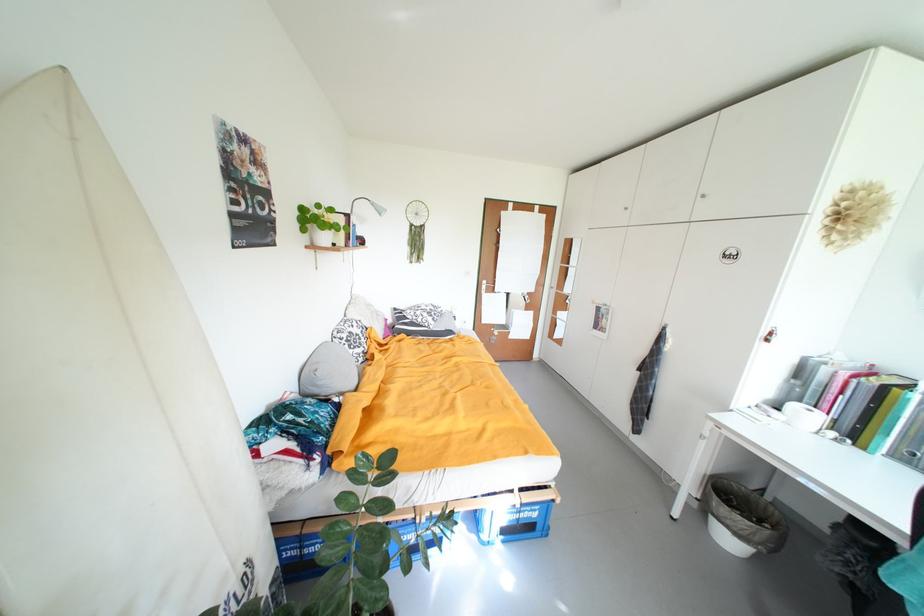
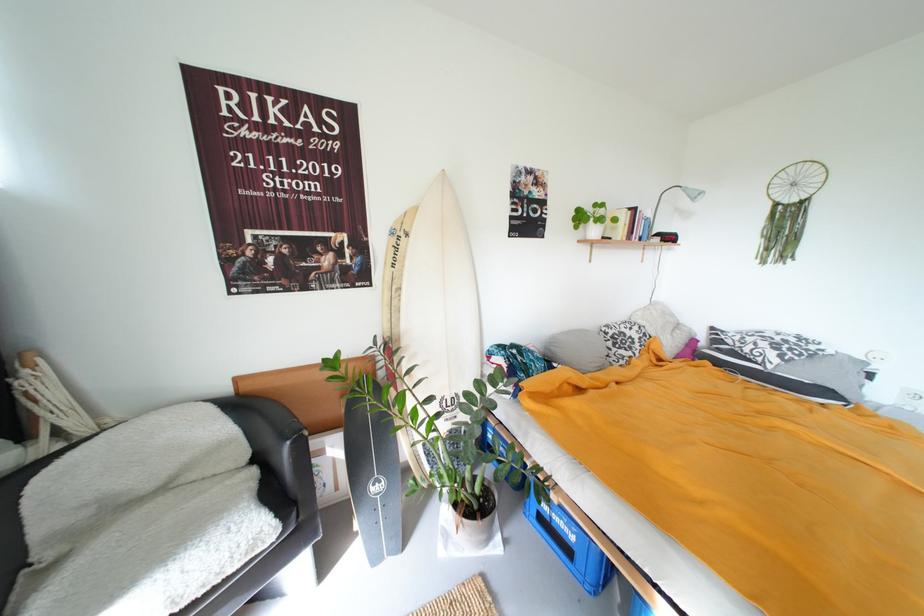
The point at [370,244] is marked in the first image. Where is the corresponding point in the second image?

(677, 240)